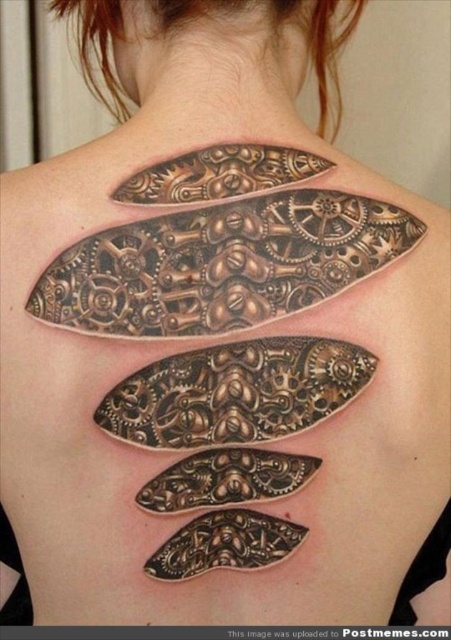
You are an artist reviewing a tattoo design. The design includes a bronze metallic gear at center and a black textured gear at center. Which gear in the tattoo has a larger vertical size?

The bronze metallic gear at center has a greater height compared to the black textured gear at center, so the bronze metallic gear at center is larger vertically.

You are an artist trying to replicate this tattoo. You need to know the exact position of the bronze metallic gear at center. Can you tell me its 2D coordinates?

The bronze metallic gear at center is located at the 2D coordinates of point (235, 392).

You are an artist trying to replicate the tattoo. You have two gears to place on the spine. The first is the brushed metal gear at upper center and the second is the bronze metallic gear at center. Which gear should you make bigger to match the original tattoo?

The brushed metal gear at upper center should be made bigger than the bronze metallic gear at center because the brushed metal gear at upper center has a larger size compared to bronze metallic gear at center in the original tattoo.